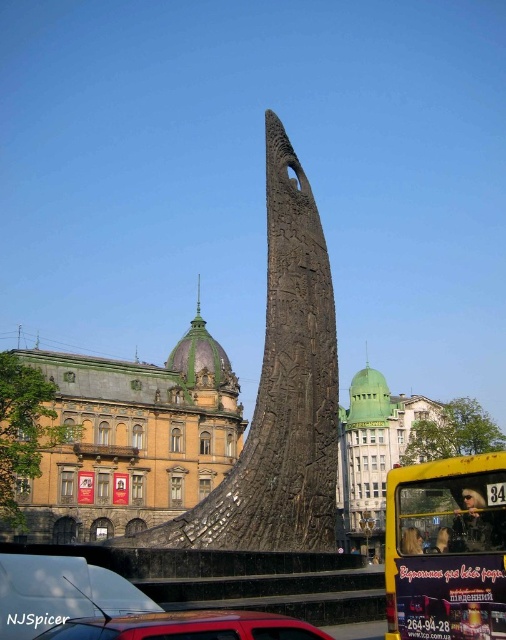
Is yellow matte/decorative bus at lower right to the left of metallic red car at lower center from the viewer's perspective?

Incorrect, yellow matte/decorative bus at lower right is not on the left side of metallic red car at lower center.

Who is more forward, (437, 536) or (220, 614)?

Point (220, 614) is in front.

Locate an element on the screen. The width and height of the screenshot is (506, 640). yellow matte/decorative bus at lower right is located at coordinates click(x=446, y=548).

Who is shorter, metallic red car at lower left or metallic red car at lower center?

With less height is metallic red car at lower center.

This screenshot has width=506, height=640. What do you see at coordinates (61, 593) in the screenshot? I see `metallic red car at lower left` at bounding box center [61, 593].

At what (x,y) coordinates should I click in order to perform the action: click on metallic red car at lower left. Please return your answer as a coordinate pair (x, y). Looking at the image, I should click on (61, 593).

You are a GUI agent. You are given a task and a screenshot of the screen. Output one action in this format:
    pyautogui.click(x=<x>, y=<y>)
    Task: Click on the metallic red car at lower left
    The image size is (506, 640).
    Given the screenshot: What is the action you would take?
    pyautogui.click(x=61, y=593)

Based on the photo, could you measure the distance between black textured stone monument at center and yellow matte/decorative bus at lower right?

black textured stone monument at center and yellow matte/decorative bus at lower right are 48.63 feet apart from each other.

The height and width of the screenshot is (640, 506). Identify the location of black textured stone monument at center. (279, 394).